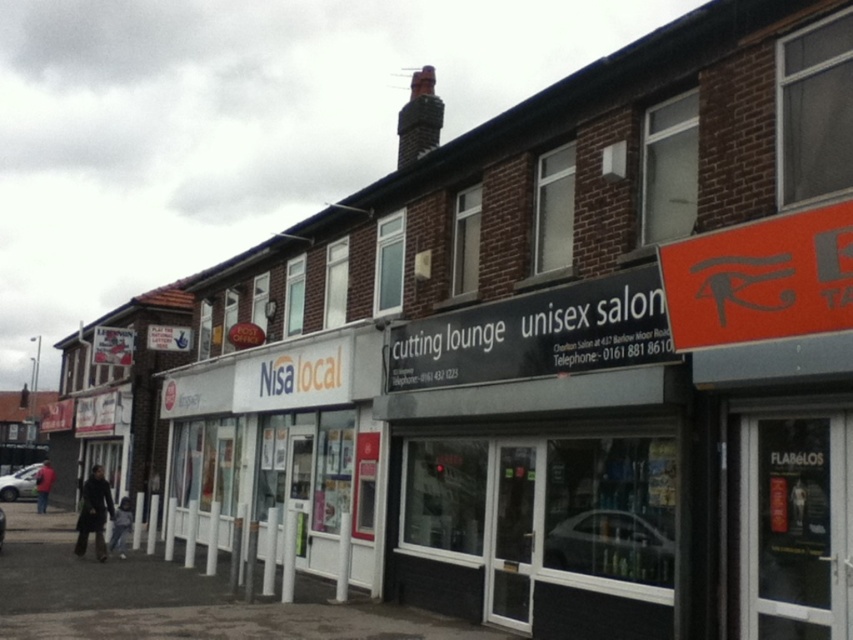
You are standing in front of the Nisa Local shop and notice a black plastic sign at center. According to the coordinates provided, is the sign closer to the top or bottom of the image?

The black plastic sign at center is located at point 0.523 on the vertical axis and 0.630 on the horizontal axis. Since the vertical coordinate is 0.523, which is less than 0.5, it is closer to the bottom of the image.